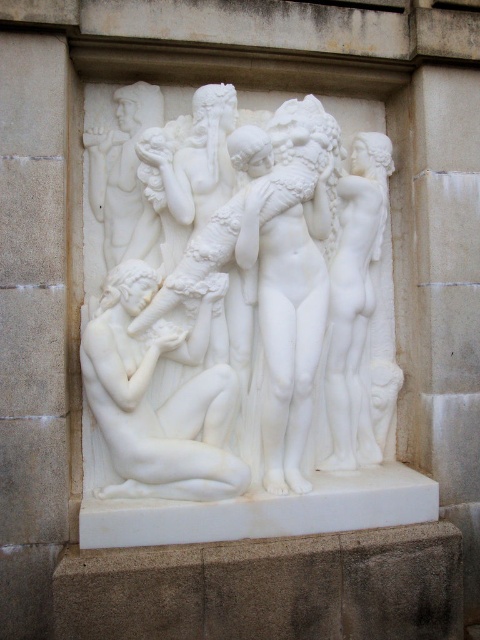
Is point (249, 326) in front of point (328, 164)?

No.

Is point (190, 266) closer to viewer compared to point (276, 337)?

Yes.

The width and height of the screenshot is (480, 640). Find the location of `white marble sculpture at center`. white marble sculpture at center is located at coordinates (245, 308).

Is point (269, 227) positioned before point (336, 275)?

Yes, it is.

Image resolution: width=480 pixels, height=640 pixels. What do you see at coordinates (290, 296) in the screenshot?
I see `white marble goddess at center` at bounding box center [290, 296].

Image resolution: width=480 pixels, height=640 pixels. Describe the element at coordinates (290, 296) in the screenshot. I see `white marble goddess at center` at that location.

You are a GUI agent. You are given a task and a screenshot of the screen. Output one action in this format:
    pyautogui.click(x=<x>, y=<y>)
    Task: Click on the white marble goddess at center
    The image size is (480, 640).
    Given the screenshot: What is the action you would take?
    pyautogui.click(x=290, y=296)

Is the position of white marble nude at lower left less distant than that of white marble goddess at center?

Yes.

Does white marble nude at lower left appear on the right side of white marble goddess at center?

Incorrect, white marble nude at lower left is not on the right side of white marble goddess at center.

Image resolution: width=480 pixels, height=640 pixels. I want to click on white marble nude at lower left, so click(x=165, y=401).

This screenshot has height=640, width=480. Identify the location of white marble nude at lower left. (165, 401).